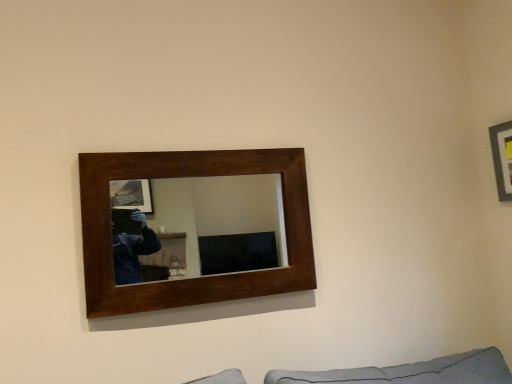
Question: Do you think wooden picture frame at upper right, acting as the 2th picture frame starting from the left, is within dark wood/matte picture frame at upper center, the 2th picture frame in the right-to-left sequence, or outside of it?

Choices:
 (A) inside
 (B) outside

Answer: (B)

Question: Is wooden picture frame at upper right, acting as the 2th picture frame starting from the left, wider or thinner than dark wood/matte picture frame at upper center, the first picture frame positioned from the left?

Choices:
 (A) wide
 (B) thin

Answer: (B)

Question: Considering the positions of point coord(498,165) and point coord(189,286), is point coord(498,165) closer or farther from the camera than point coord(189,286)?

Choices:
 (A) closer
 (B) farther

Answer: (B)

Question: Is dark wood/matte picture frame at upper center, the 2th picture frame in the right-to-left sequence, inside the boundaries of wooden picture frame at upper right, acting as the 2th picture frame starting from the left, or outside?

Choices:
 (A) outside
 (B) inside

Answer: (A)

Question: Is dark wood/matte picture frame at upper center, the 2th picture frame in the right-to-left sequence, bigger or smaller than wooden picture frame at upper right, acting as the first picture frame starting from the right?

Choices:
 (A) small
 (B) big

Answer: (B)

Question: Does point (268, 172) appear closer or farther from the camera than point (506, 188)?

Choices:
 (A) closer
 (B) farther

Answer: (A)

Question: In the image, is dark wood/matte picture frame at upper center, the 2th picture frame in the right-to-left sequence, positioned in front of or behind wooden picture frame at upper right, acting as the 2th picture frame starting from the left?

Choices:
 (A) behind
 (B) front

Answer: (B)